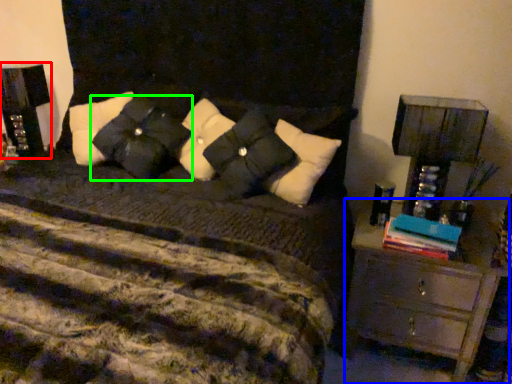
Question: Considering the real-world distances, which object is farthest from nightstand (highlighted by a red box)? chest of drawers (highlighted by a blue box) or pillow (highlighted by a green box)?

Choices:
 (A) chest of drawers
 (B) pillow

Answer: (A)